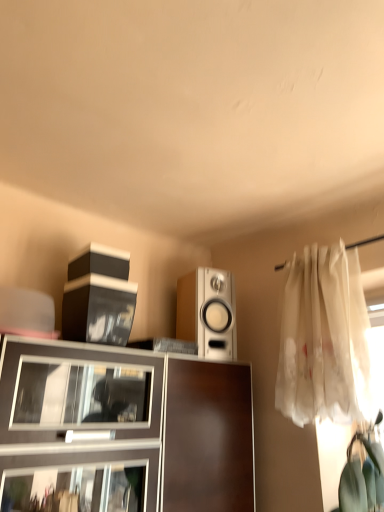
Question: Is matte brown cabinet at center closer to the viewer compared to white sheer curtain at right?

Choices:
 (A) yes
 (B) no

Answer: (A)

Question: Is matte brown cabinet at center wider than white sheer curtain at right?

Choices:
 (A) no
 (B) yes

Answer: (B)

Question: Considering the relative positions of matte brown cabinet at center and white sheer curtain at right in the image provided, is matte brown cabinet at center to the right of white sheer curtain at right from the viewer's perspective?

Choices:
 (A) yes
 (B) no

Answer: (B)

Question: Considering the relative sizes of matte brown cabinet at center and white sheer curtain at right in the image provided, is matte brown cabinet at center smaller than white sheer curtain at right?

Choices:
 (A) yes
 (B) no

Answer: (B)

Question: Does matte brown cabinet at center have a lesser height compared to white sheer curtain at right?

Choices:
 (A) no
 (B) yes

Answer: (B)

Question: From the image's perspective, is matte brown cabinet at center above white sheer curtain at right?

Choices:
 (A) yes
 (B) no

Answer: (B)

Question: Does white sheer curtain at right turn towards matte brown cabinet at center?

Choices:
 (A) yes
 (B) no

Answer: (B)

Question: Is white sheer curtain at right behind matte brown cabinet at center?

Choices:
 (A) no
 (B) yes

Answer: (B)

Question: Can we say white sheer curtain at right lies outside matte brown cabinet at center?

Choices:
 (A) yes
 (B) no

Answer: (A)

Question: Is white sheer curtain at right smaller than matte brown cabinet at center?

Choices:
 (A) yes
 (B) no

Answer: (A)

Question: Is white sheer curtain at right looking in the opposite direction of matte brown cabinet at center?

Choices:
 (A) no
 (B) yes

Answer: (A)

Question: Does white sheer curtain at right have a lesser width compared to matte brown cabinet at center?

Choices:
 (A) yes
 (B) no

Answer: (A)

Question: Does white glossy speaker at center have a greater height compared to white sheer curtain at right?

Choices:
 (A) yes
 (B) no

Answer: (B)